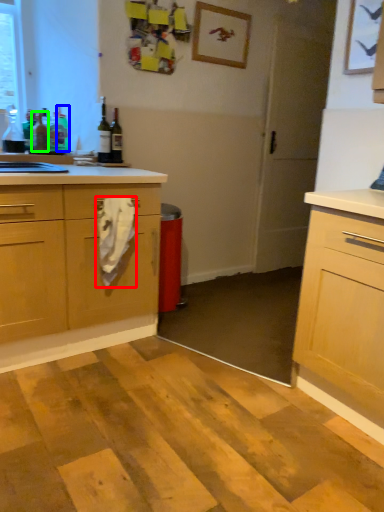
Question: Estimate the real-world distances between objects in this image. Which object is farther from material (highlighted by a red box), bottle (highlighted by a blue box) or bottle (highlighted by a green box)?

Choices:
 (A) bottle
 (B) bottle

Answer: (A)